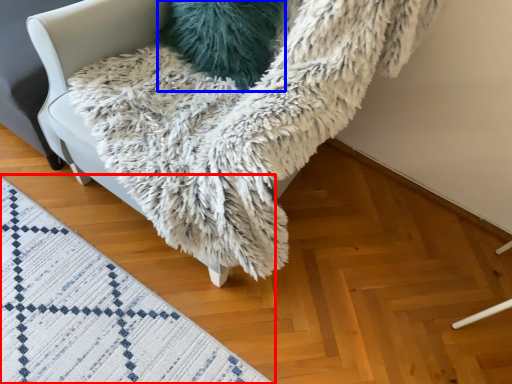
Question: Which object appears closest to the camera in this image, mat (highlighted by a red box) or pillow (highlighted by a blue box)?

Choices:
 (A) mat
 (B) pillow

Answer: (A)